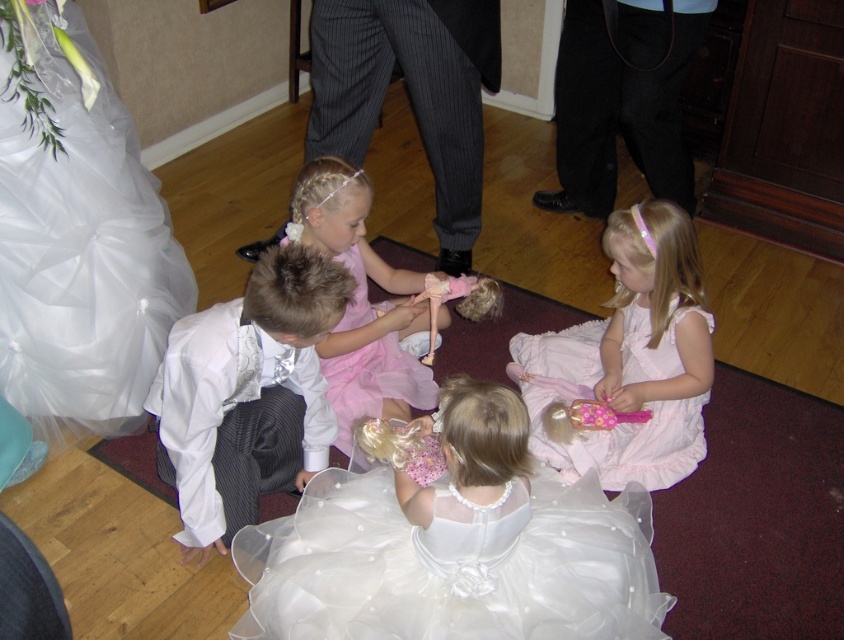
Question: Among these objects, which one is nearest to the camera?

Choices:
 (A) white satin suit at lower left
 (B) pink tulle dress at center
 (C) pink tulle dress at lower center
 (D) white tulle dress at lower left

Answer: (A)

Question: Is white satin suit at lower left behind pink tulle dress at center?

Choices:
 (A) yes
 (B) no

Answer: (B)

Question: Which object is farther from the camera taking this photo?

Choices:
 (A) pink tulle dress at lower center
 (B) white satin suit at lower left

Answer: (A)

Question: Considering the relative positions of white satin dress at center and pink tulle dress at center in the image provided, where is white satin dress at center located with respect to pink tulle dress at center?

Choices:
 (A) right
 (B) left

Answer: (A)

Question: Which of the following is the closest to the observer?

Choices:
 (A) white satin suit at lower left
 (B) white tulle dress at lower left
 (C) white satin dress at center
 (D) pink tulle dress at center

Answer: (C)

Question: Where is white satin dress at center located in relation to white satin suit at lower left in the image?

Choices:
 (A) left
 (B) right

Answer: (B)